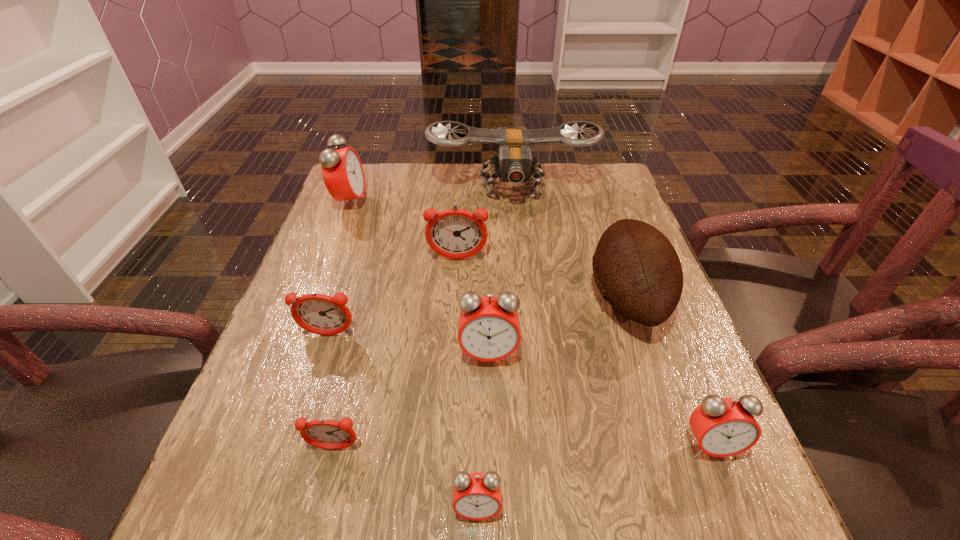
You are a GUI agent. You are given a task and a screenshot of the screen. Output one action in this format:
    pyautogui.click(x=<x>, y=<y>)
    Task: Click on the reddish-pink alarm clock that is the closest to the drone
    
    Given the screenshot: What is the action you would take?
    pyautogui.click(x=454, y=233)

You are a GUI agent. You are given a task and a screenshot of the screen. Output one action in this format:
    pyautogui.click(x=<x>, y=<y>)
    Task: Click on the reddish-pink alarm clock that stands as the second closest to the nearest alarm clock
    The width and height of the screenshot is (960, 540).
    Given the screenshot: What is the action you would take?
    pyautogui.click(x=321, y=314)